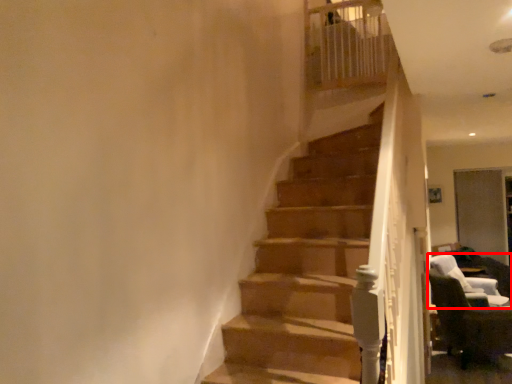
Question: Observing the image, what is the correct spatial positioning of chair (annotated by the red box) in reference to chair?

Choices:
 (A) left
 (B) right

Answer: (B)